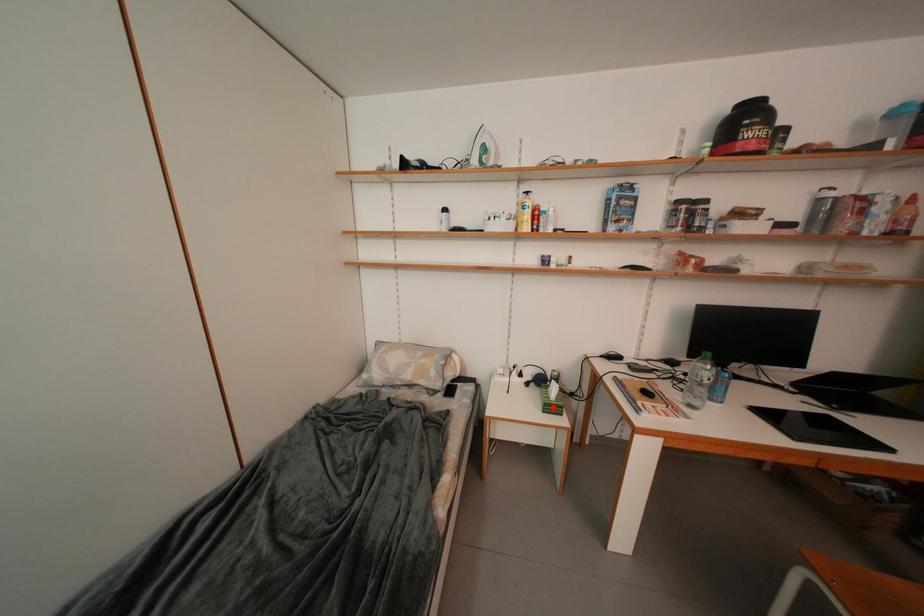
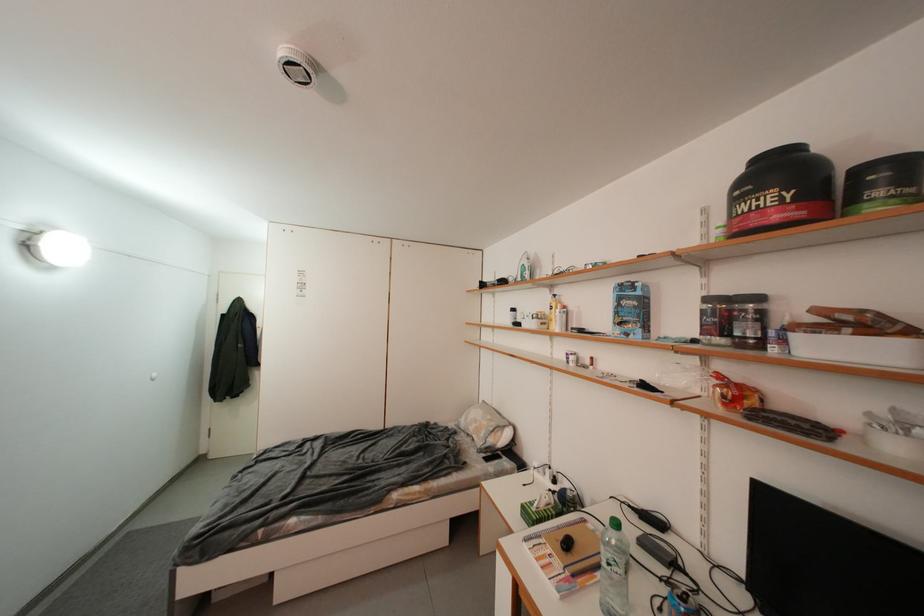
Locate, in the second image, the point that corresponds to the highlighted location in the first image.

(530, 509)